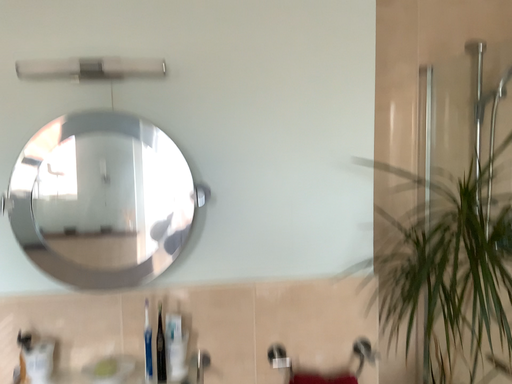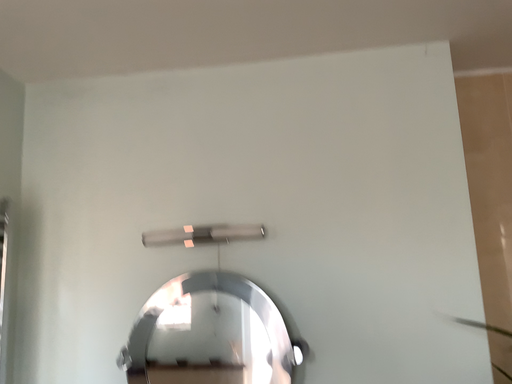
Question: How did the camera likely rotate when shooting the video?

Choices:
 (A) rotated left
 (B) rotated right

Answer: (A)